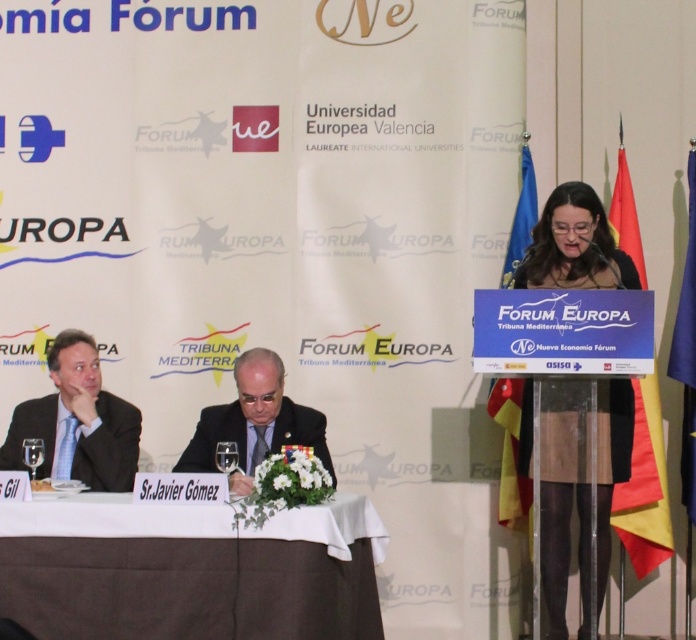
Question: Which point appears farthest from the camera in this image?

Choices:
 (A) (329, 621)
 (B) (237, 390)
 (C) (603, 536)

Answer: (B)

Question: Which point is farther to the camera?

Choices:
 (A) dark suit at center
 (B) matte black suit at left
 (C) white cloth at lower center

Answer: (B)

Question: Which point is farther to the camera?

Choices:
 (A) white cloth at lower center
 (B) matte black dress at center
 (C) blue fabric flag at right
 (D) red fabric flag at right

Answer: (C)

Question: Is white cloth at lower center positioned in front of dark suit at center?

Choices:
 (A) no
 (B) yes

Answer: (B)

Question: Is white cloth at lower center above matte black dress at center?

Choices:
 (A) no
 (B) yes

Answer: (A)

Question: Is red fabric flag at right smaller than blue fabric flag at right?

Choices:
 (A) yes
 (B) no

Answer: (B)